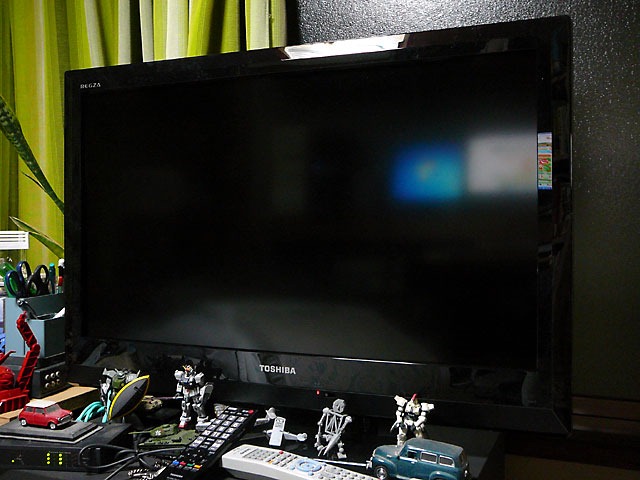
At what (x,y) coordinates should I click in order to perform the action: click on remote. Please return your answer as a coordinate pair (x, y). Looking at the image, I should click on (260, 453), (321, 472), (235, 412), (209, 444), (187, 468).